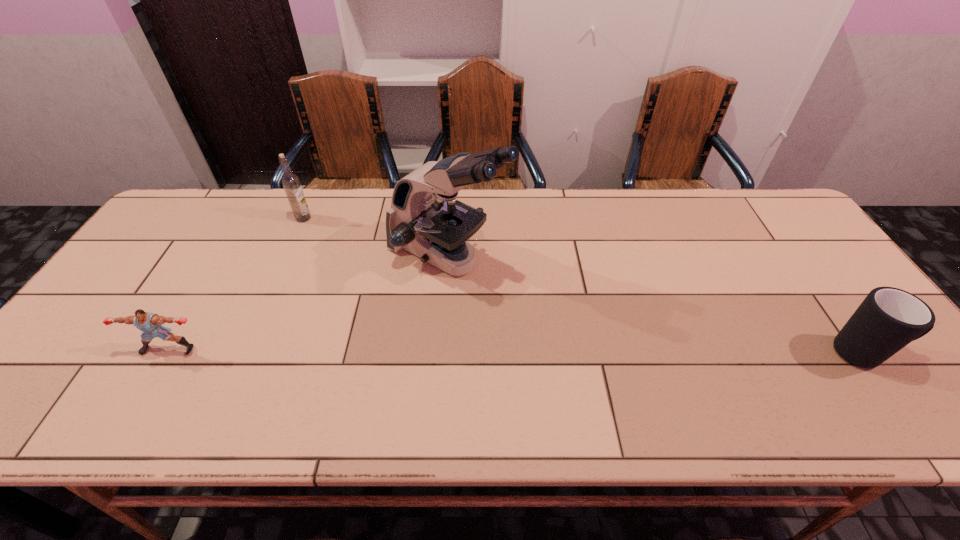
Identify the location of free space that is in between the shortest object and the tallest object. (308, 303).

Identify the location of free space between the farthest object and the puncher. click(236, 284).

The image size is (960, 540). In order to click on free space between the shortest object and the vodka in this screenshot , I will do [x=236, y=284].

At what (x,y) coordinates should I click in order to perform the action: click on free space between the third shortest object and the leftmost object. Please return your answer as a coordinate pair (x, y). Looking at the image, I should click on (236, 284).

The width and height of the screenshot is (960, 540). Find the location of `vacant point located between the tallest object and the shortest object`. vacant point located between the tallest object and the shortest object is located at coordinates (308, 303).

Locate an element on the screen. The height and width of the screenshot is (540, 960). free space between the tallest object and the leftmost object is located at coordinates click(308, 303).

Identify the location of free area in between the shortest object and the second shortest object. This screenshot has width=960, height=540. (517, 351).

The width and height of the screenshot is (960, 540). What are the coordinates of `vacant space that is in between the rightmost object and the shortest object` in the screenshot? It's located at (517, 351).

Find the location of a particular element. This screenshot has width=960, height=540. object that ranks as the second closest to the tallest object is located at coordinates (150, 324).

At what (x,y) coordinates should I click in order to perform the action: click on object that is the third closest to the microscope. Please return your answer as a coordinate pair (x, y). The image size is (960, 540). Looking at the image, I should click on (888, 319).